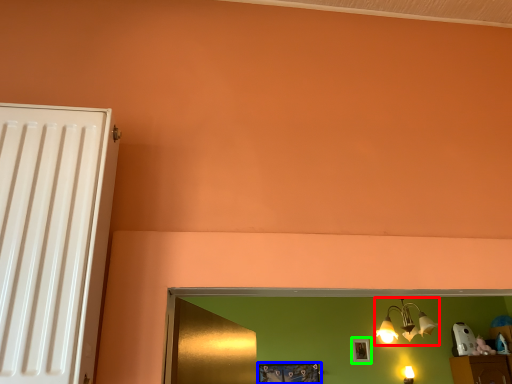
Question: Which is farther away from lamp (highlighted by a red box)? picture frame (highlighted by a blue box) or picture frame (highlighted by a green box)?

Choices:
 (A) picture frame
 (B) picture frame

Answer: (A)